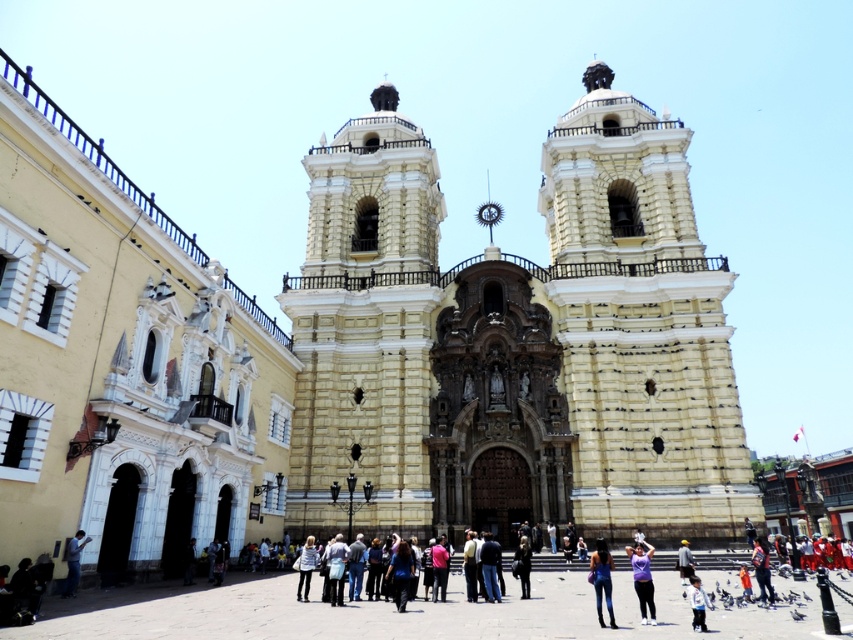
Question: Does purple matte shirt at lower center appear on the right side of dark blue jeans at center?

Choices:
 (A) yes
 (B) no

Answer: (B)

Question: Estimate the real-world distances between objects in this image. Which object is farther from the pink fabric at center?

Choices:
 (A) dark brown leather jacket at center
 (B) black leather jacket at center
 (C) denim pants at lower left

Answer: (C)

Question: In this image, where is purple matte shirt at lower center located relative to black leather jacket at center?

Choices:
 (A) below
 (B) above

Answer: (B)

Question: Estimate the real-world distances between objects in this image. Which object is closer to the denim pants at lower left?

Choices:
 (A) purple matte shirt at lower center
 (B) dark brown leather jacket at center

Answer: (B)

Question: Which of these objects is positioned farthest from the dark blue jeans at center?

Choices:
 (A) blue denim jeans at lower center
 (B) white textured coat at lower center

Answer: (B)

Question: Can you confirm if purple matte shirt at lower center is positioned above pink fabric at center?

Choices:
 (A) yes
 (B) no

Answer: (A)